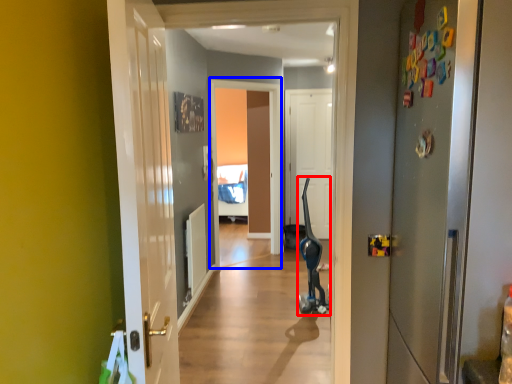
Question: Which object is further to the camera taking this photo, segway (highlighted by a red box) or screen door (highlighted by a blue box)?

Choices:
 (A) segway
 (B) screen door

Answer: (B)